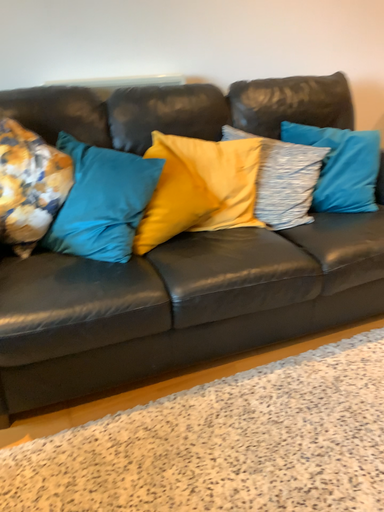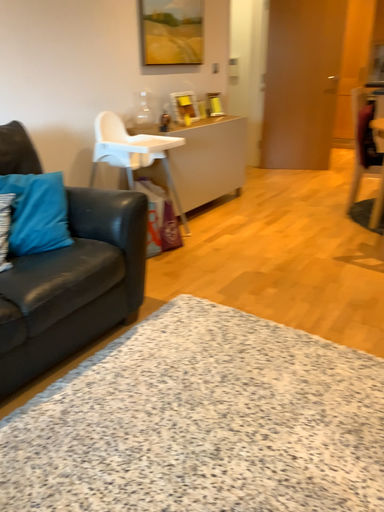
Question: Which way did the camera rotate in the video?

Choices:
 (A) rotated right
 (B) rotated left

Answer: (A)